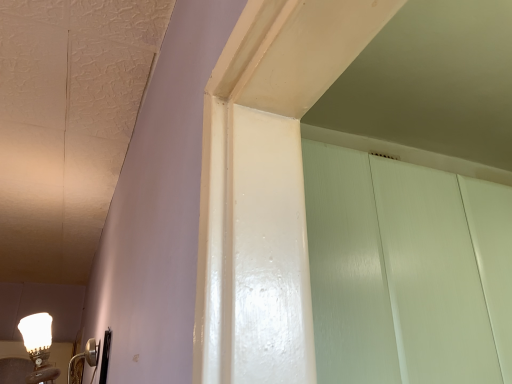
Measure the distance between point (376, 348) and camera.

Point (376, 348) is 85.90 centimeters away from camera.

You are a GUI agent. You are given a task and a screenshot of the screen. Output one action in this format:
    pyautogui.click(x=<x>, y=<y>)
    Task: Click on the white glossy door at upper center
    Image resolution: width=512 pixels, height=384 pixels.
    Given the screenshot: What is the action you would take?
    pyautogui.click(x=406, y=271)

The image size is (512, 384). What do you see at coordinates (406, 271) in the screenshot?
I see `white glossy door at upper center` at bounding box center [406, 271].

Locate an element on the screen. This screenshot has height=384, width=512. white glossy door at upper center is located at coordinates 406,271.